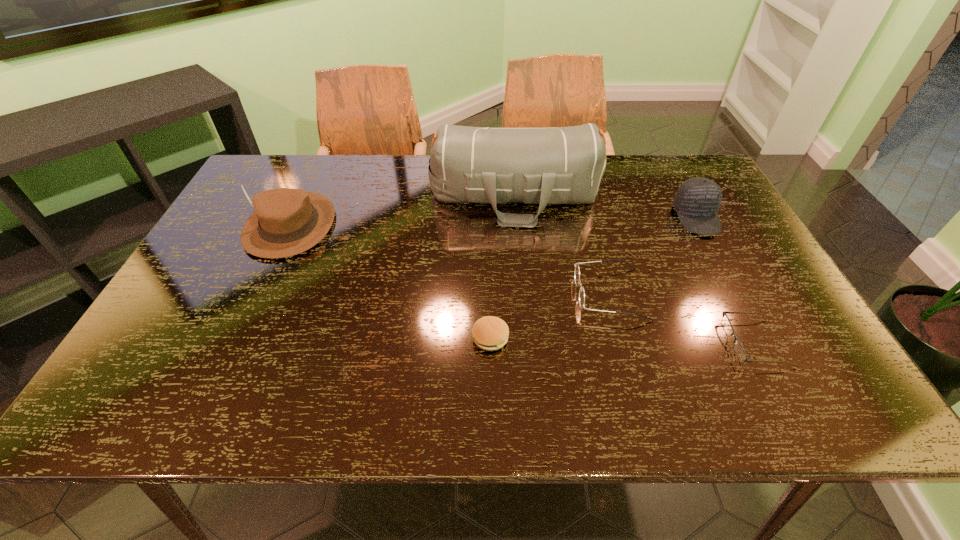
Identify the location of vacant area that lies between the shortest object and the taller spectacles. (684, 318).

Locate an element on the screen. This screenshot has height=540, width=960. vacant region between the right spectacles and the fifth tallest object is located at coordinates (x=623, y=340).

This screenshot has width=960, height=540. In order to click on free space between the taller spectacles and the baseball cap in this screenshot , I will do `click(653, 255)`.

Find the location of a particular element. This screenshot has width=960, height=540. vacant space in between the right spectacles and the fifth shortest object is located at coordinates (523, 284).

Where is `blank region between the tallest object and the shortest object`? The height and width of the screenshot is (540, 960). blank region between the tallest object and the shortest object is located at coordinates (636, 269).

The width and height of the screenshot is (960, 540). Find the location of `free space between the fifth tallest object and the third tallest object`. free space between the fifth tallest object and the third tallest object is located at coordinates (593, 278).

At what (x,y) coordinates should I click in order to perform the action: click on vacant region between the second shortest object and the shorter spectacles. Please return your answer as a coordinate pair (x, y). Looking at the image, I should click on (623, 340).

This screenshot has width=960, height=540. What are the coordinates of `free spot between the shorter spectacles and the third shortest object` in the screenshot? It's located at (684, 318).

This screenshot has width=960, height=540. In order to click on free space between the fifth tallest object and the leftmost object in this screenshot , I will do `click(391, 281)`.

Identify the location of free space that is in between the right spectacles and the taller spectacles. This screenshot has width=960, height=540. (684, 318).